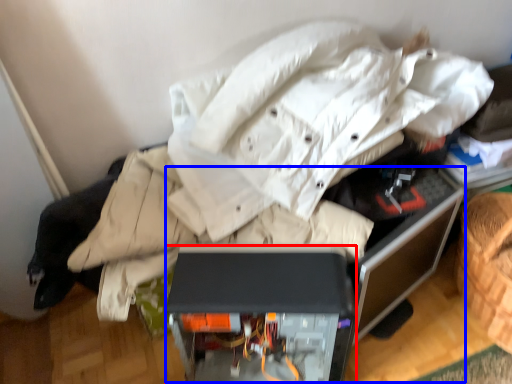
Question: Which of the following is the closest to the observer, furniture (highlighted by a red box) or computer desk (highlighted by a blue box)?

Choices:
 (A) furniture
 (B) computer desk

Answer: (B)